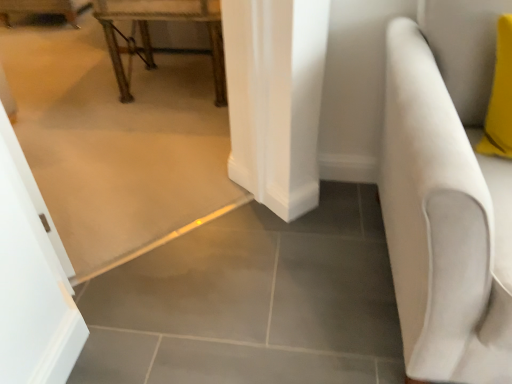
Question: Should I look upward or downward to see metallic gold table at upper left?

Choices:
 (A) up
 (B) down

Answer: (A)

Question: Is metallic gold table at upper left taller than white fabric armchair at right?

Choices:
 (A) no
 (B) yes

Answer: (A)

Question: Is metallic gold table at upper left thinner than white fabric armchair at right?

Choices:
 (A) no
 (B) yes

Answer: (B)

Question: Is metallic gold table at upper left directly adjacent to white fabric armchair at right?

Choices:
 (A) no
 (B) yes

Answer: (A)

Question: Is metallic gold table at upper left shorter than white fabric armchair at right?

Choices:
 (A) no
 (B) yes

Answer: (B)

Question: Is metallic gold table at upper left bigger than white fabric armchair at right?

Choices:
 (A) yes
 (B) no

Answer: (B)

Question: Is white fabric armchair at right a part of metallic gold table at upper left?

Choices:
 (A) yes
 (B) no

Answer: (B)

Question: Considering the relative sizes of white fabric armchair at right and metallic gold table at upper left in the image provided, is white fabric armchair at right thinner than metallic gold table at upper left?

Choices:
 (A) yes
 (B) no

Answer: (B)

Question: Is white fabric armchair at right beside metallic gold table at upper left?

Choices:
 (A) yes
 (B) no

Answer: (B)

Question: From a real-world perspective, is white fabric armchair at right located beneath metallic gold table at upper left?

Choices:
 (A) no
 (B) yes

Answer: (A)

Question: Is white fabric armchair at right shorter than metallic gold table at upper left?

Choices:
 (A) yes
 (B) no

Answer: (B)

Question: Does white fabric armchair at right appear on the right side of metallic gold table at upper left?

Choices:
 (A) no
 (B) yes

Answer: (B)

Question: Is metallic gold table at upper left a part of white fabric armchair at right?

Choices:
 (A) yes
 (B) no

Answer: (B)

Question: From the image's perspective, is white fabric armchair at right above or below metallic gold table at upper left?

Choices:
 (A) below
 (B) above

Answer: (A)